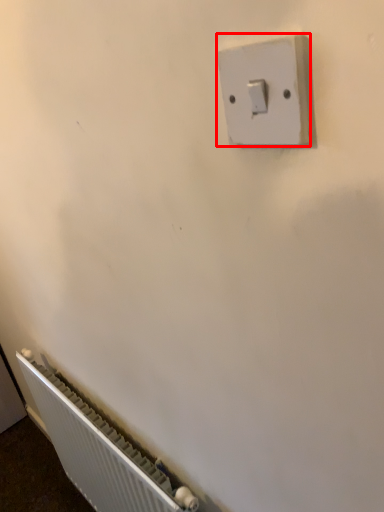
Question: From the image's perspective, what is the correct spatial positioning of light switch (annotated by the red box) in reference to radiator?

Choices:
 (A) above
 (B) below

Answer: (A)